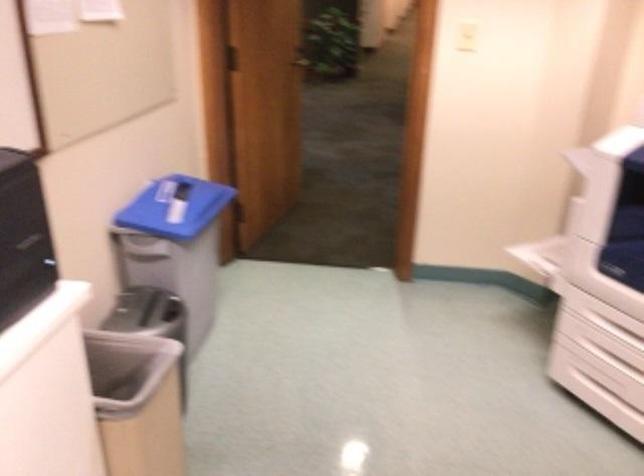
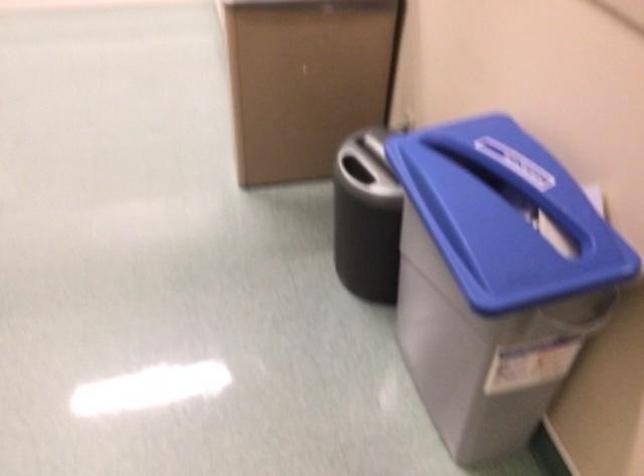
Locate, in the second image, the point that corresponds to point (178, 310) in the first image.

(366, 217)